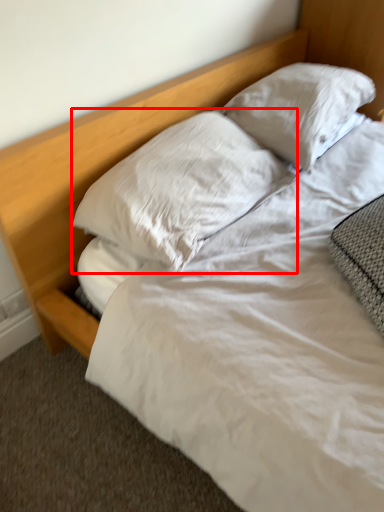
Question: From the image, what is the correct spatial relationship of pillow (annotated by the red box) in relation to pillow?

Choices:
 (A) left
 (B) right

Answer: (A)